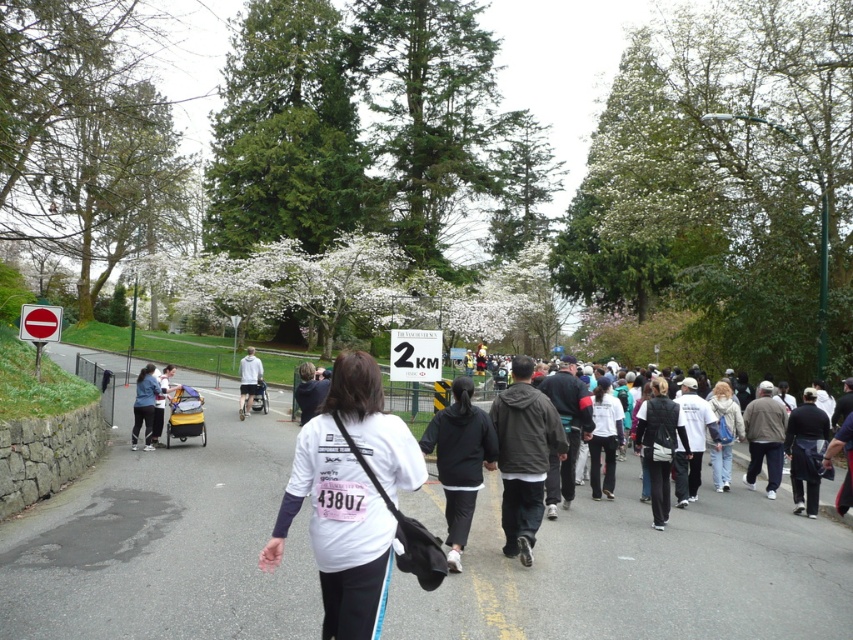
What do you see at coordinates (349, 497) in the screenshot?
I see `white matte shirt at center` at bounding box center [349, 497].

Does white matte shirt at center have a larger size compared to black fabric jacket at center?

Actually, white matte shirt at center might be smaller than black fabric jacket at center.

Which is in front, point (341, 612) or point (663, 488)?

Point (341, 612) is in front.

Find the location of a particular element. white matte shirt at center is located at coordinates (349, 497).

Does black matte sweatshirt at center have a greater width compared to black fabric jacket at center?

No, black matte sweatshirt at center is not wider than black fabric jacket at center.

Does black matte sweatshirt at center have a lesser height compared to black fabric jacket at center?

Correct, black matte sweatshirt at center is not as tall as black fabric jacket at center.

Who is more forward, (465, 376) or (654, 435)?

Point (654, 435)

I want to click on black matte sweatshirt at center, so click(459, 460).

Which is more to the left, white matte shirt at center or white fuzzy jacket at right?

white matte shirt at center

Is white matte shirt at center smaller than white fuzzy jacket at right?

Yes.

Who is more forward, (303,493) or (720,419)?

Positioned in front is point (303,493).

Find the location of `white matte shirt at center`. white matte shirt at center is located at coordinates (349, 497).